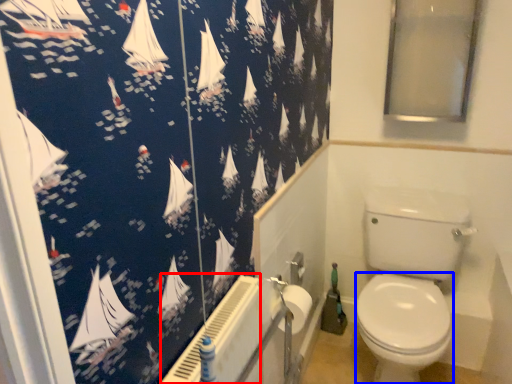
Question: Which object is closer to the camera taking this photo, radiator (highlighted by a red box) or bidet (highlighted by a blue box)?

Choices:
 (A) radiator
 (B) bidet

Answer: (A)